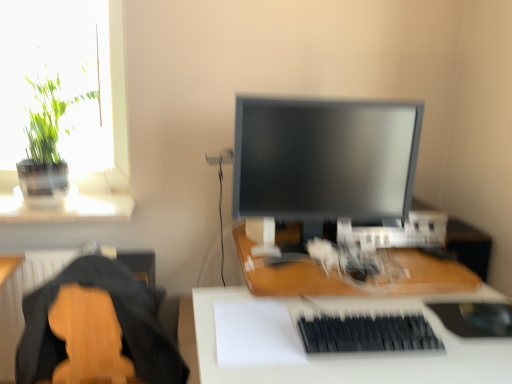
At what (x,y) coordinates should I click in order to perform the action: click on vacant space to the left of black matte keyboard at lower center. Please return your answer as a coordinate pair (x, y). This screenshot has width=512, height=384. Looking at the image, I should click on (266, 340).